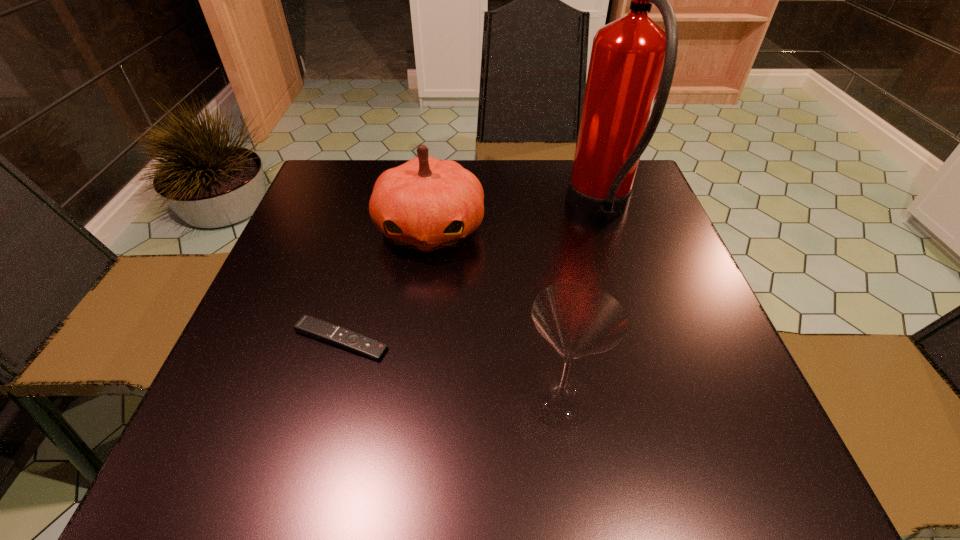
Locate an element on the screen. vacant space at the far left corner is located at coordinates (368, 198).

Locate an element on the screen. This screenshot has width=960, height=540. blank space at the far right corner of the desktop is located at coordinates (635, 190).

Locate an element on the screen. vacant area that lies between the tallest object and the pumpkin is located at coordinates (516, 220).

Locate an element on the screen. free area in between the remote control and the pumpkin is located at coordinates (386, 285).

Locate an element on the screen. This screenshot has height=540, width=960. free point between the pumpkin and the nearest object is located at coordinates (495, 314).

This screenshot has width=960, height=540. I want to click on vacant space that is in between the remote control and the pumpkin, so click(x=386, y=285).

Find the location of a particular element. This screenshot has width=960, height=540. empty space that is in between the second object from right to left and the shortest object is located at coordinates (450, 369).

Where is `vacant area between the rightmost object and the pumpkin`? vacant area between the rightmost object and the pumpkin is located at coordinates (516, 220).

In order to click on the third closest object to the pumpkin in this screenshot , I will do coord(578,319).

Identify which object is the second nearest to the pumpkin. Please provide its 2D coordinates. Your answer should be formatted as a tuple, i.e. [(x, y)], where the tuple contains the x and y coordinates of a point satisfying the conditions above.

[(633, 59)]